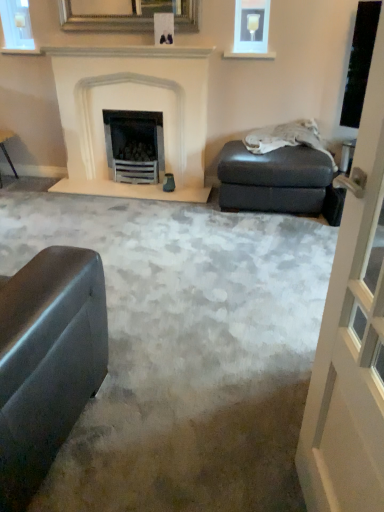
Question: Would you consider matte gray footrest at right to be distant from gold-framed mirror at upper center, positioned as the 2th picture frame in right-to-left order?

Choices:
 (A) no
 (B) yes

Answer: (B)

Question: From the image's perspective, is matte gray footrest at right under gold-framed mirror at upper center, positioned as the 2th picture frame in right-to-left order?

Choices:
 (A) no
 (B) yes

Answer: (B)

Question: Does matte gray footrest at right have a smaller size compared to gold-framed mirror at upper center, positioned as the 2th picture frame in right-to-left order?

Choices:
 (A) yes
 (B) no

Answer: (B)

Question: Considering the relative sizes of matte gray footrest at right and gold-framed mirror at upper center, positioned as the 2th picture frame in right-to-left order, in the image provided, is matte gray footrest at right wider than gold-framed mirror at upper center, positioned as the 2th picture frame in right-to-left order,?

Choices:
 (A) yes
 (B) no

Answer: (A)

Question: Is matte gray footrest at right facing away from gold-framed mirror at upper center, which is the first picture frame in left-to-right order?

Choices:
 (A) no
 (B) yes

Answer: (A)

Question: From a real-world perspective, is matte gray footrest at right positioned over gold-framed mirror at upper center, which is the first picture frame in left-to-right order, based on gravity?

Choices:
 (A) no
 (B) yes

Answer: (A)

Question: Does white stone fireplace at center touch matte glass frame at upper right, the 2th picture frame viewed from the left?

Choices:
 (A) no
 (B) yes

Answer: (A)

Question: Considering the relative positions of white stone fireplace at center and matte glass frame at upper right, which ranks as the first picture frame in right-to-left order, in the image provided, is white stone fireplace at center behind matte glass frame at upper right, which ranks as the first picture frame in right-to-left order,?

Choices:
 (A) no
 (B) yes

Answer: (A)

Question: Can you confirm if white stone fireplace at center is smaller than matte glass frame at upper right, the 2th picture frame viewed from the left?

Choices:
 (A) no
 (B) yes

Answer: (A)

Question: Does white stone fireplace at center have a greater height compared to matte glass frame at upper right, the 2th picture frame viewed from the left?

Choices:
 (A) yes
 (B) no

Answer: (A)

Question: Can you confirm if white stone fireplace at center is shorter than matte glass frame at upper right, the 2th picture frame viewed from the left?

Choices:
 (A) no
 (B) yes

Answer: (A)

Question: From a real-world perspective, does white stone fireplace at center stand above matte glass frame at upper right, which ranks as the first picture frame in right-to-left order?

Choices:
 (A) yes
 (B) no

Answer: (B)

Question: Can you confirm if transparent glass screen door at right is thinner than white stone fireplace at center?

Choices:
 (A) no
 (B) yes

Answer: (B)